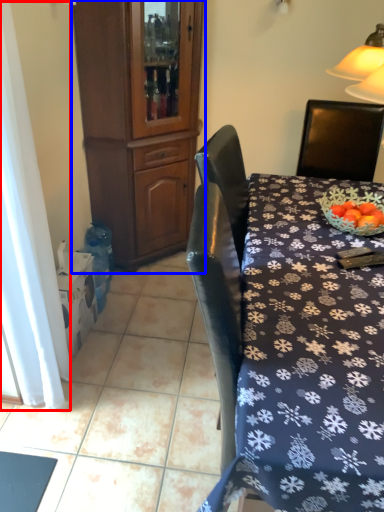
Question: Which object appears farthest to the camera in this image, curtain (highlighted by a red box) or cabinetry (highlighted by a blue box)?

Choices:
 (A) curtain
 (B) cabinetry

Answer: (B)